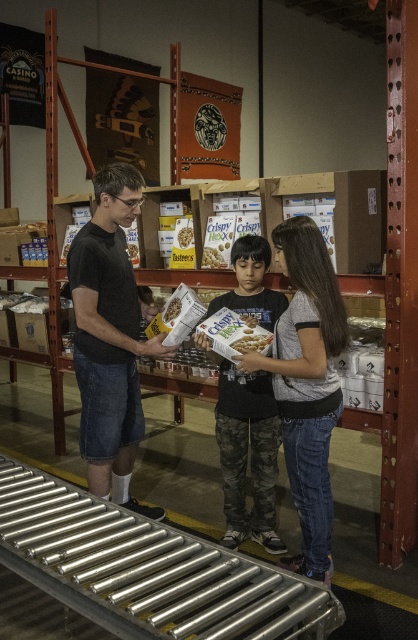
Which is more to the right, matte gray shirt at center or white cardboard cereal box at center?

From the viewer's perspective, matte gray shirt at center appears more on the right side.

Looking at this image, does matte gray shirt at center have a greater width compared to white cardboard cereal box at center?

Yes.

Is point (305, 294) positioned after point (167, 321)?

No, (305, 294) is in front of (167, 321).

Identify the location of matte gray shirt at center. The height and width of the screenshot is (640, 418). (306, 384).

Between point (180, 300) and point (188, 234), which one is positioned behind?

Positioned behind is point (188, 234).

Does white cardboard cereal box at center appear over white cardboard box of batten's at center?

No.

Find the location of a particular element. Image resolution: width=418 pixels, height=640 pixels. white cardboard cereal box at center is located at coordinates (171, 308).

Can you confirm if white matte cereal box at center is bigger than white cardboard cereal box at center?

Yes.

Identify the location of white matte cereal box at center. The height and width of the screenshot is (640, 418). (252, 340).

Where is `white matte cereal box at center`? white matte cereal box at center is located at coordinates (252, 340).